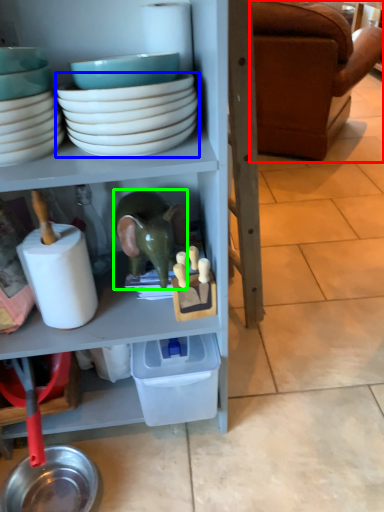
Question: Which object is the farthest from studio couch (highlighted by a red box)? Choose among these: bowl (highlighted by a blue box) or toy (highlighted by a green box).

Choices:
 (A) bowl
 (B) toy

Answer: (A)